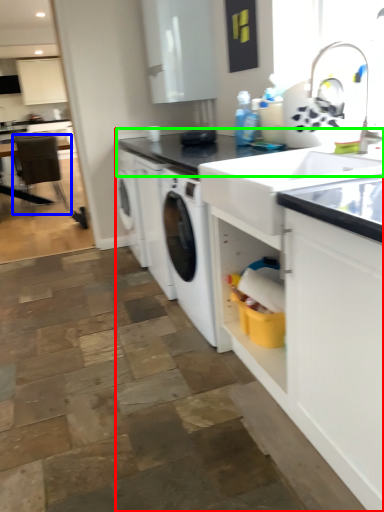
Question: Considering the real-world distances, which object is closest to countertop (highlighted by a red box)? chair (highlighted by a blue box) or countertop (highlighted by a green box).

Choices:
 (A) chair
 (B) countertop

Answer: (B)